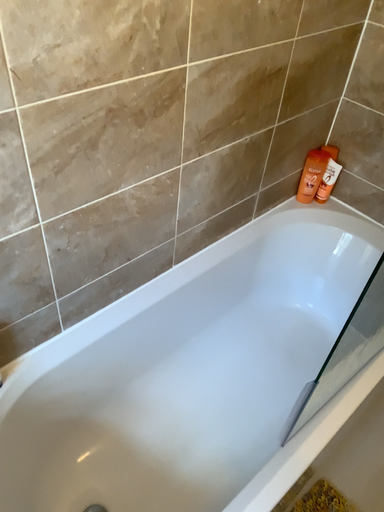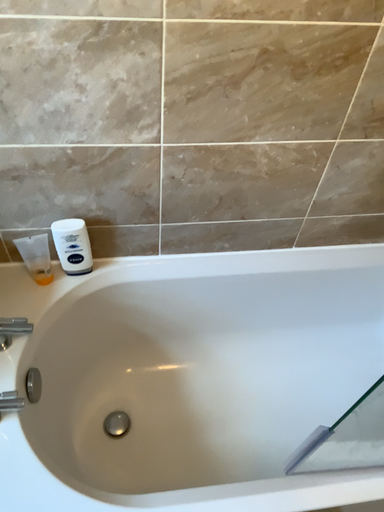
Question: How did the camera likely rotate when shooting the video?

Choices:
 (A) rotated left
 (B) rotated right

Answer: (A)